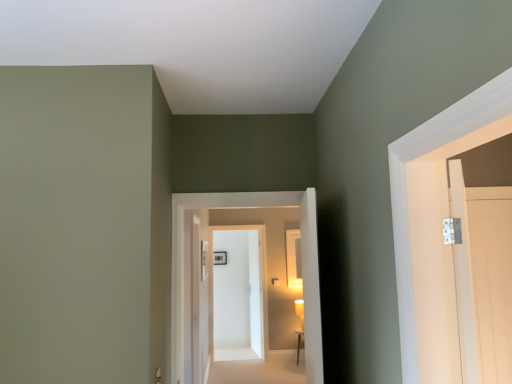
The image size is (512, 384). What do you see at coordinates (303, 266) in the screenshot?
I see `white glossy door at center, arranged as the second door when viewed from the right` at bounding box center [303, 266].

Image resolution: width=512 pixels, height=384 pixels. In order to click on smooth beige carpet at center in this screenshot , I will do `click(256, 367)`.

Based on the photo, is matte gold wall sconce at center inside the boundaries of light wood door at right, arranged as the second door when viewed from the front, or outside?

matte gold wall sconce at center is outside light wood door at right, arranged as the second door when viewed from the front.

Is matte gold wall sconce at center to the left of light wood door at right, the fourth door when ordered from left to right, from the viewer's perspective?

Correct, you'll find matte gold wall sconce at center to the left of light wood door at right, the fourth door when ordered from left to right.

Considering the sizes of objects matte gold wall sconce at center and light wood door at right, the fourth door when ordered from left to right, in the image provided, who is shorter, matte gold wall sconce at center or light wood door at right, the fourth door when ordered from left to right,?

matte gold wall sconce at center.

Does white glossy door at center, arranged as the 2th door when viewed from the back, appear on the right side of matte gold wall sconce at center?

In fact, white glossy door at center, arranged as the 2th door when viewed from the back, is to the left of matte gold wall sconce at center.

Which is behind, point (195, 297) or point (298, 315)?

The point (298, 315) is behind.

Is white glossy door at center, arranged as the 2th door when viewed from the back, located outside matte gold wall sconce at center?

Indeed, white glossy door at center, arranged as the 2th door when viewed from the back, is completely outside matte gold wall sconce at center.

Who is smaller, white glossy door at center, which appears as the first door when viewed from the back, or white glossy door at center, arranged as the 2th door when viewed from the back?

white glossy door at center, which appears as the first door when viewed from the back.

Is point (223, 315) closer or farther from the camera than point (199, 327)?

Clearly, point (223, 315) is more distant from the camera than point (199, 327).

Which is behind, white glossy door at center, the 3th door viewed from the right, or white glossy door at center, arranged as the 2th door when viewed from the back?

white glossy door at center, the 3th door viewed from the right, is further away from the camera.

Is smooth beige carpet at center far from white glossy door at center, placed as the 3th door when sorted from front to back?

Yes.

From the image's perspective, is smooth beige carpet at center on top of white glossy door at center, which ranks as the 1th door in left-to-right order?

Actually, smooth beige carpet at center appears below white glossy door at center, which ranks as the 1th door in left-to-right order, in the image.

Is the position of smooth beige carpet at center more distant than that of white glossy door at center, arranged as the 2th door when viewed from the back?

Yes, it is behind white glossy door at center, arranged as the 2th door when viewed from the back.

Is matte gold wall sconce at center turned away from white glossy door at center, which is the 1th door from front to back?

matte gold wall sconce at center is not turned away from white glossy door at center, which is the 1th door from front to back.

Considering the positions of point (296, 305) and point (315, 193), is point (296, 305) closer or farther from the camera than point (315, 193)?

Point (296, 305).

Can we say matte gold wall sconce at center lies outside white glossy door at center, which is the 1th door from front to back?

Yes.

Can you tell me how much matte gold wall sconce at center and white glossy door at center, which is the 1th door from front to back, differ in facing direction?

0.479 degrees.

Is white glossy door at center, the fourth door from the right, inside or outside of white glossy door at center, placed as the fourth door when sorted from front to back?

The correct answer is: outside.

Are white glossy door at center, placed as the 3th door when sorted from front to back, and white glossy door at center, placed as the fourth door when sorted from front to back, far apart?

Yes, white glossy door at center, placed as the 3th door when sorted from front to back, and white glossy door at center, placed as the fourth door when sorted from front to back, are located far from each other.

Considering the positions of point (196, 273) and point (255, 284), is point (196, 273) closer or farther from the camera than point (255, 284)?

Point (196, 273) is positioned closer to the camera compared to point (255, 284).

Find the location of a particular element. The height and width of the screenshot is (384, 512). door that appears on the right of smooth beige carpet at center is located at coordinates (483, 278).

In the scene shown: Measure the distance between smooth beige carpet at center and light wood door at right, the fourth door when ordered from left to right.

A distance of 11.15 feet exists between smooth beige carpet at center and light wood door at right, the fourth door when ordered from left to right.

Is smooth beige carpet at center next to light wood door at right, arranged as the second door when viewed from the front?

No.

Considering the positions of objects smooth beige carpet at center and light wood door at right, which ranks as the first door in right-to-left order, in the image provided, who is more to the right, smooth beige carpet at center or light wood door at right, which ranks as the first door in right-to-left order,?

Positioned to the right is light wood door at right, which ranks as the first door in right-to-left order.

Where is `light fixture lying on the left of light wood door at right, which ranks as the first door in right-to-left order`? light fixture lying on the left of light wood door at right, which ranks as the first door in right-to-left order is located at coordinates (300, 311).

What are the coordinates of `light fixture that is under the white glossy door at center, arranged as the 2th door when viewed from the back (from a real-world perspective)` in the screenshot? It's located at (300, 311).

Looking at the image, which one is located further to white glossy door at center, arranged as the 2th door when viewed from the back, light wood door at right, acting as the 3th door starting from the back, or white glossy door at center, which appears as the 3th door when viewed from the left?

Based on the image, light wood door at right, acting as the 3th door starting from the back, appears to be further to white glossy door at center, arranged as the 2th door when viewed from the back.

Which object lies nearer to the anchor point white glossy door at center, placed as the fourth door when sorted from front to back, smooth beige carpet at center or white glossy door at center, placed as the 3th door when sorted from front to back?

smooth beige carpet at center lies closer to white glossy door at center, placed as the fourth door when sorted from front to back, than the other object.

Estimate the real-world distances between objects in this image. Which object is further from white glossy door at center, arranged as the 2th door when viewed from the back, smooth beige carpet at center or light wood door at right, the fourth door when ordered from left to right?

light wood door at right, the fourth door when ordered from left to right, lies further to white glossy door at center, arranged as the 2th door when viewed from the back, than the other object.

Estimate the real-world distances between objects in this image. Which object is further from white glossy door at center, the 3th door viewed from the right, white glossy door at center, arranged as the 2th door when viewed from the back, or white glossy door at center, which is the 1th door from front to back?

white glossy door at center, which is the 1th door from front to back.

Based on their spatial positions, is light wood door at right, which ranks as the first door in right-to-left order, or white glossy door at center, arranged as the second door when viewed from the left, further from smooth beige carpet at center?

Based on the image, light wood door at right, which ranks as the first door in right-to-left order, appears to be further to smooth beige carpet at center.

Which object lies further to the anchor point matte gold wall sconce at center, white glossy door at center, which appears as the 3th door when viewed from the left, or white glossy door at center, which ranks as the 1th door in left-to-right order?

white glossy door at center, which appears as the 3th door when viewed from the left, is positioned further to the anchor matte gold wall sconce at center.

When comparing their distances from smooth beige carpet at center, does light wood door at right, which ranks as the first door in right-to-left order, or white glossy door at center, which ranks as the 1th door in left-to-right order, seem closer?

white glossy door at center, which ranks as the 1th door in left-to-right order, lies closer to smooth beige carpet at center than the other object.

Estimate the real-world distances between objects in this image. Which object is closer to smooth beige carpet at center, white glossy door at center, which ranks as the 1th door in left-to-right order, or white glossy door at center, the 3th door viewed from the right?

white glossy door at center, the 3th door viewed from the right, lies closer to smooth beige carpet at center than the other object.

Where is `light fixture between white glossy door at center, which is the 1th door from front to back, and white glossy door at center, which appears as the first door when viewed from the back, in the front-back direction`? This screenshot has width=512, height=384. light fixture between white glossy door at center, which is the 1th door from front to back, and white glossy door at center, which appears as the first door when viewed from the back, in the front-back direction is located at coordinates (300, 311).

Identify the location of path positioned between white glossy door at center, which is the fourth door in back-to-front order, and white glossy door at center, the 3th door viewed from the right, from near to far. (256, 367).

In order to click on light fixture between smooth beige carpet at center and white glossy door at center, placed as the fourth door when sorted from front to back, from front to back in this screenshot , I will do `click(300, 311)`.

Locate an element on the screen. This screenshot has width=512, height=384. path between white glossy door at center, the fourth door from the right, and white glossy door at center, which appears as the first door when viewed from the back, from front to back is located at coordinates (256, 367).